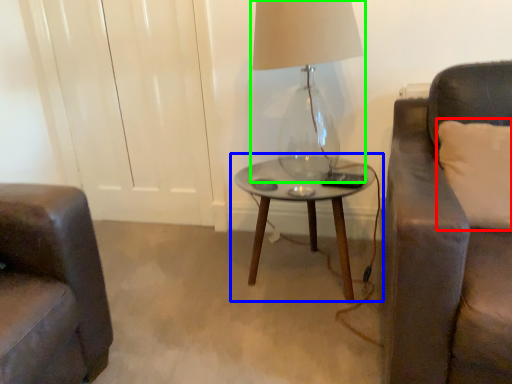
Question: Which is farther away from pillow (highlighted by a red box)? table (highlighted by a blue box) or lamp (highlighted by a green box)?

Choices:
 (A) table
 (B) lamp

Answer: (B)